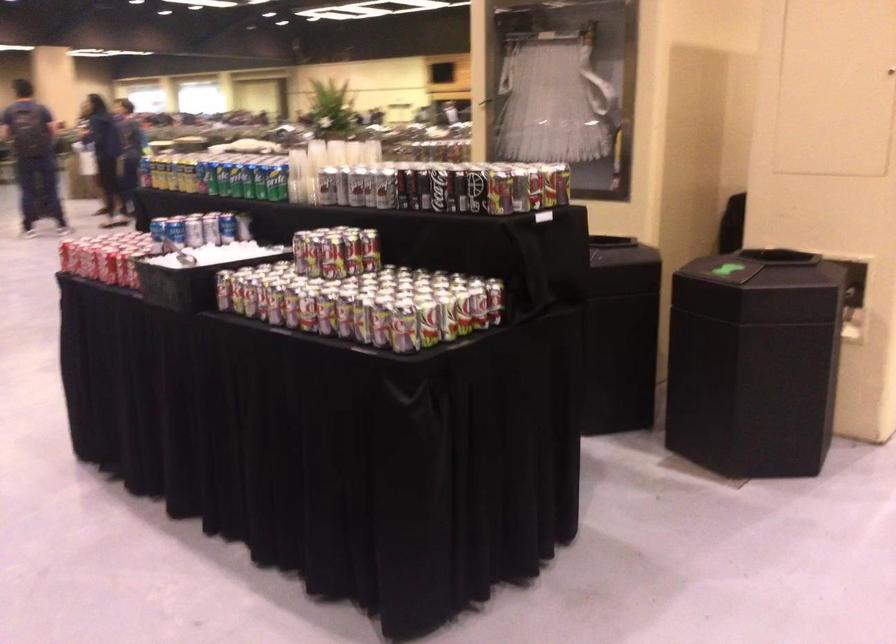
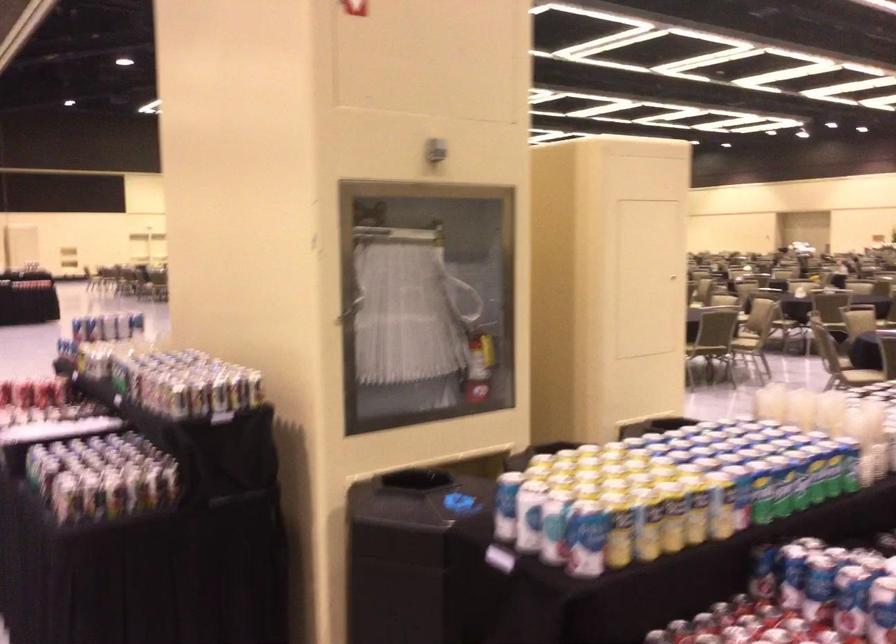
Where in the second image is the point corresponding to the point at 217,218 from the first image?

(762, 572)